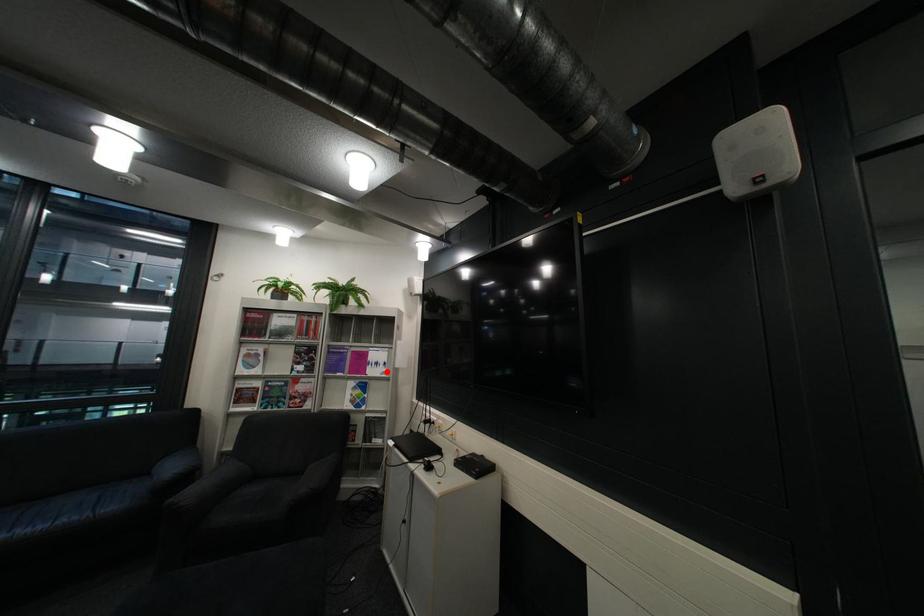
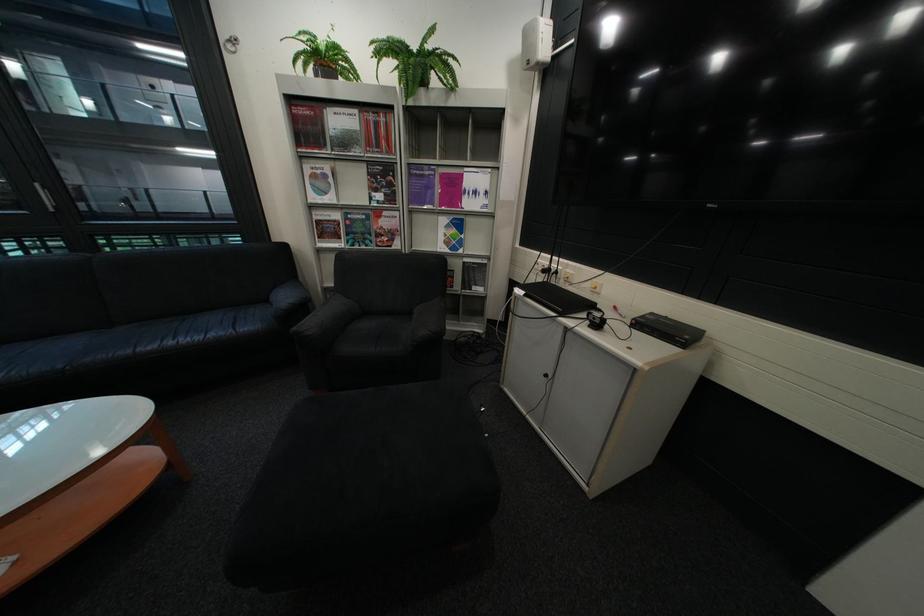
The point at the highlighted location is marked in the first image. Where is the corresponding point in the second image?

(484, 204)